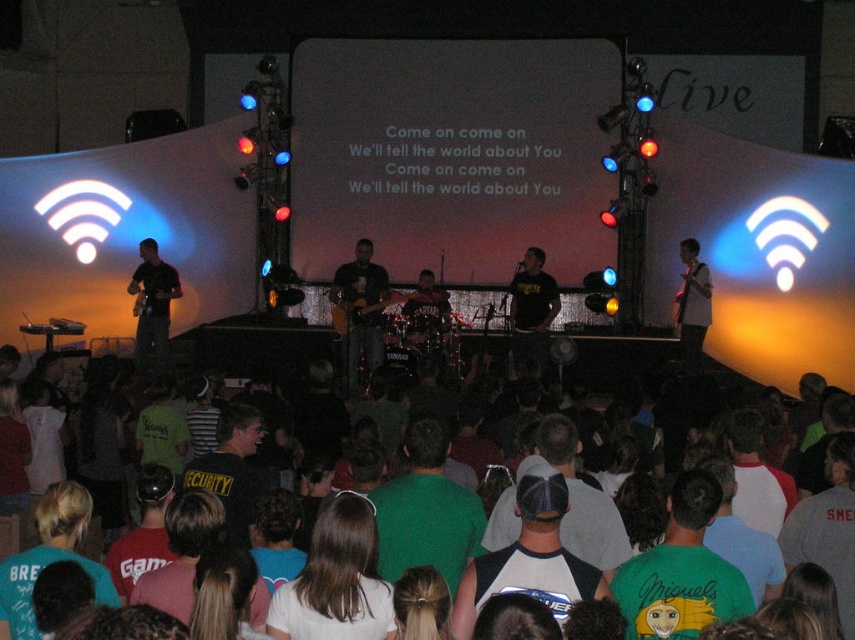
Question: Based on their relative distances, which object is farther from the green t-shirt at center?

Choices:
 (A) dark gray mesh cap at center
 (B) green t-shirt at lower left
 (C) camouflage shirt at left
 (D) green matte shirt at center

Answer: (C)

Question: Which point appears closest to the camera in this image?

Choices:
 (A) (137, 294)
 (B) (372, 333)
 (C) (693, 483)

Answer: (C)

Question: Does dark green t-shirt at center appear over camouflage shirt at left?

Choices:
 (A) yes
 (B) no

Answer: (B)

Question: Is matte black guitar at center thinner than black matte shirt at center?

Choices:
 (A) yes
 (B) no

Answer: (B)

Question: Is matte black guitar at center positioned before black matte shirt at center?

Choices:
 (A) no
 (B) yes

Answer: (A)

Question: Which point appears closest to the camera in this image?

Choices:
 (A) (388, 496)
 (B) (467, 540)
 (C) (525, 305)

Answer: (B)